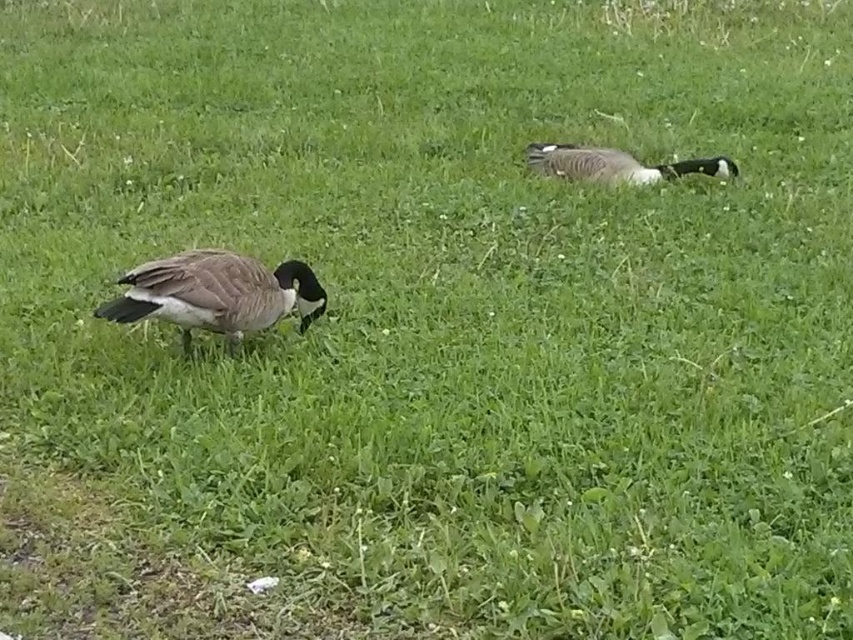
Which is in front, point (254, 316) or point (646, 177)?

Point (254, 316) is more forward.

Does brown feathered duck at left appear under brown feathered duck at upper right?

Yes, brown feathered duck at left is below brown feathered duck at upper right.

This screenshot has width=853, height=640. I want to click on brown feathered duck at left, so click(x=216, y=294).

Identify the location of brown feathered duck at left. This screenshot has height=640, width=853. (216, 294).